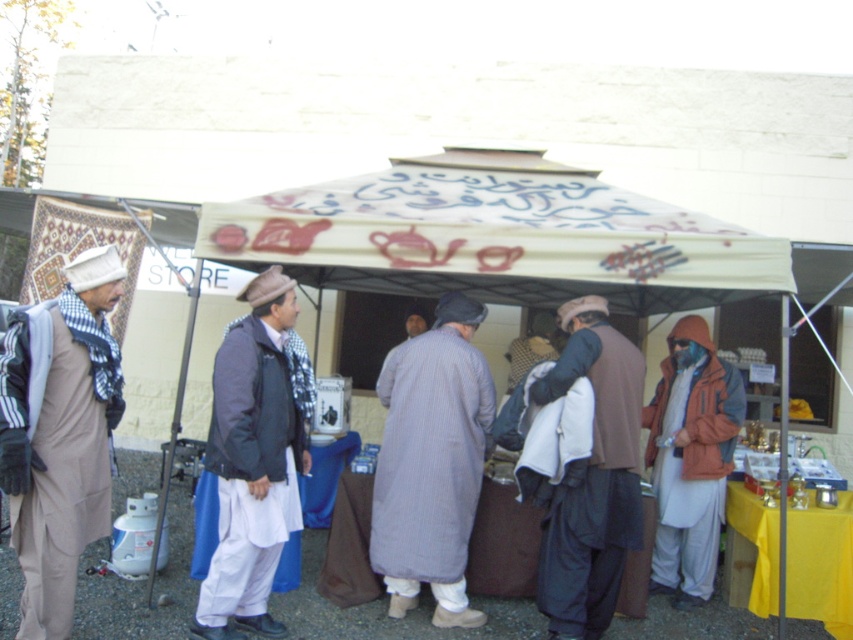
Question: Observing the image, what is the correct spatial positioning of striped cotton robe at center in reference to dark gray fabric jacket at center?

Choices:
 (A) left
 (B) right

Answer: (B)

Question: Among these points, which one is farthest from the camera?

Choices:
 (A) (x=38, y=440)
 (B) (x=270, y=355)
 (C) (x=386, y=365)
 (D) (x=595, y=330)

Answer: (C)

Question: Which point appears farthest from the camera in this image?

Choices:
 (A) (274, 628)
 (B) (431, 257)
 (C) (36, 612)
 (D) (704, 460)

Answer: (D)

Question: Can you confirm if beige canvas tent at center is positioned below dark gray fabric jacket at center?

Choices:
 (A) yes
 (B) no

Answer: (B)

Question: Considering the real-world distances, which object is closest to the beige canvas tent at center?

Choices:
 (A) blue fabric mask at right
 (B) beige woolen robe at left

Answer: (A)

Question: Considering the relative positions of dark gray fabric jacket at center and blue fabric mask at right in the image provided, where is dark gray fabric jacket at center located with respect to blue fabric mask at right?

Choices:
 (A) above
 (B) below

Answer: (A)